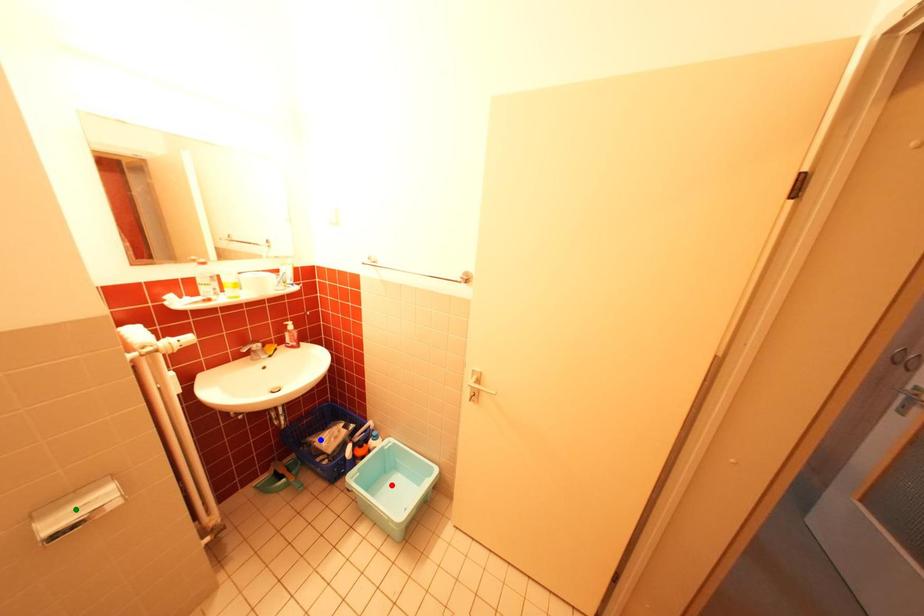
Order these from nearest to farthest:
green point, blue point, red point

green point
red point
blue point